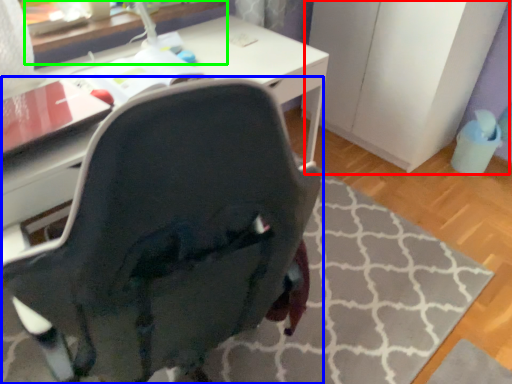
Question: Which object is the closest to the file cabinet (highlighted by a red box)? Choose among these: chair (highlighted by a blue box) or table (highlighted by a green box).

Choices:
 (A) chair
 (B) table

Answer: (B)